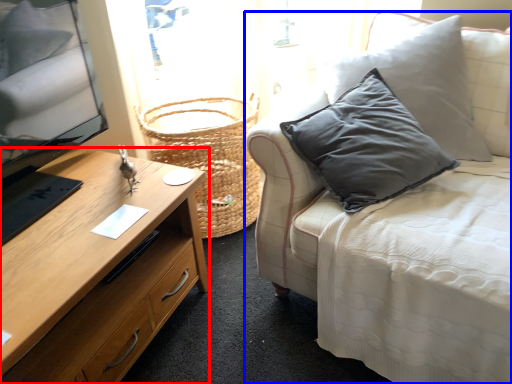
Question: Which of the following is the closest to the observer, desk (highlighted by a red box) or studio couch (highlighted by a blue box)?

Choices:
 (A) desk
 (B) studio couch

Answer: (B)